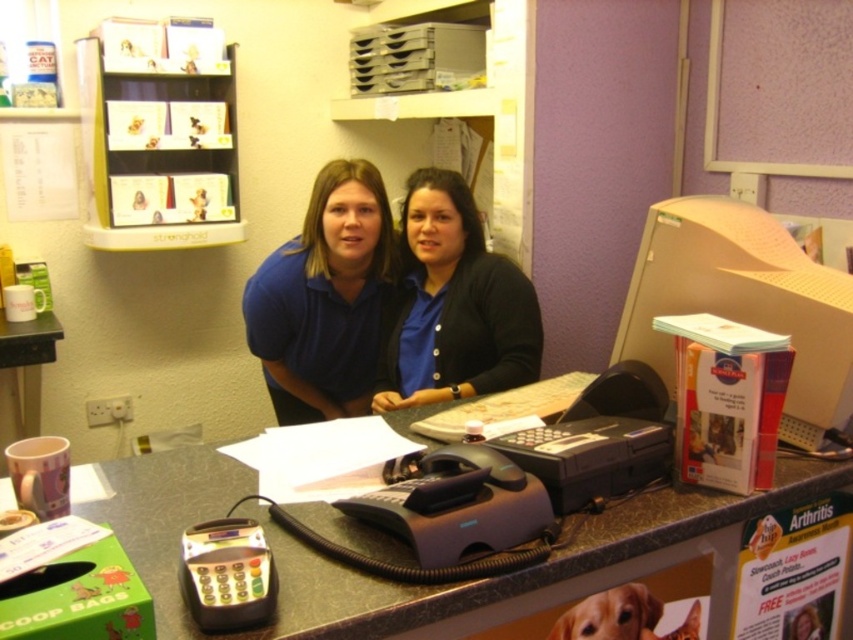
You are a customer standing at the entrance of the veterinary clinic reception area. You need to place a small plant on the counter between the two points labeled point (686,513) and point (325,355). Which point should you place it closer to if you want the plant to be more visible to people entering the clinic?

You should place the plant closer to point (686,513) because it is closer to the camera, making it more visible to people entering the clinic.

You are a customer entering the veterinary clinic and need to locate the marble countertop at center. According to the scene description, where would you find it?

The marble countertop at center is located at point (x=383, y=580).

You are a customer entering the veterinary clinic and need to approach the counter. You notice the blue matte shirt at center and the black matte cardigan at center. Which clothing item is wider?

The blue matte shirt at center is wider than the black matte cardigan at center.